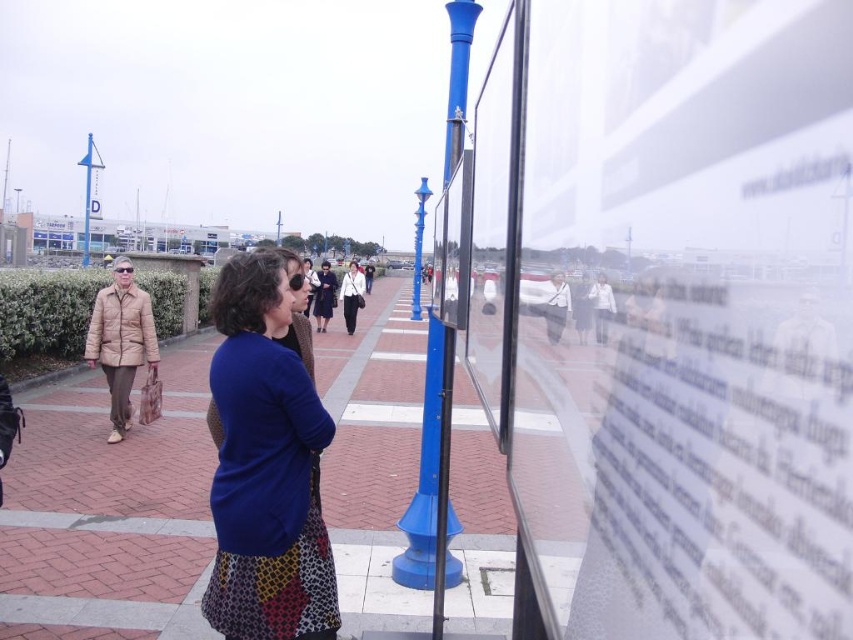
Consider the image. Can you confirm if brick pavement at center is positioned to the left of green leafy hedge at left?

No, brick pavement at center is not to the left of green leafy hedge at left.

Who is higher up, brick pavement at center or green leafy hedge at left?

green leafy hedge at left is higher up.

The image size is (853, 640). Identify the location of brick pavement at center. (109, 513).

Is blue fabric skirt at center to the right of green leafy hedge at left from the viewer's perspective?

Yes, blue fabric skirt at center is to the right of green leafy hedge at left.

Which of these two, blue fabric skirt at center or green leafy hedge at left, stands shorter?

blue fabric skirt at center

Is point (268, 620) closer to viewer compared to point (0, 304)?

Yes, it is in front of point (0, 304).

Locate an element on the screen. This screenshot has width=853, height=640. blue fabric skirt at center is located at coordinates (265, 468).

Can you confirm if brick pavement at center is smaller than blue fabric skirt at center?

Incorrect, brick pavement at center is not smaller in size than blue fabric skirt at center.

Can you confirm if brick pavement at center is bigger than blue fabric skirt at center?

Correct, brick pavement at center is larger in size than blue fabric skirt at center.

Locate an element on the screen. brick pavement at center is located at coordinates (109, 513).

You are a GUI agent. You are given a task and a screenshot of the screen. Output one action in this format:
    pyautogui.click(x=<x>, y=<y>)
    Task: Click on the brick pavement at center
    The image size is (853, 640).
    Given the screenshot: What is the action you would take?
    pyautogui.click(x=109, y=513)